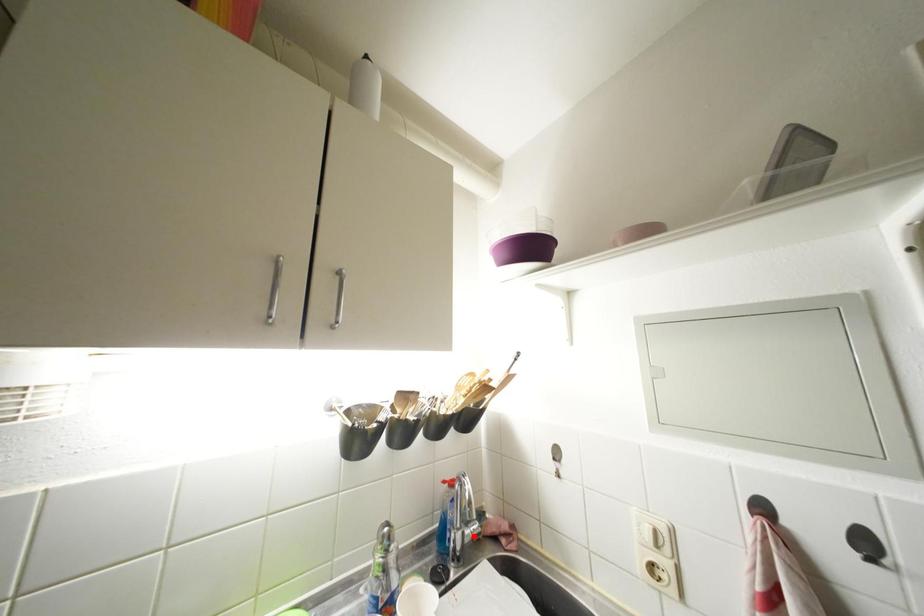
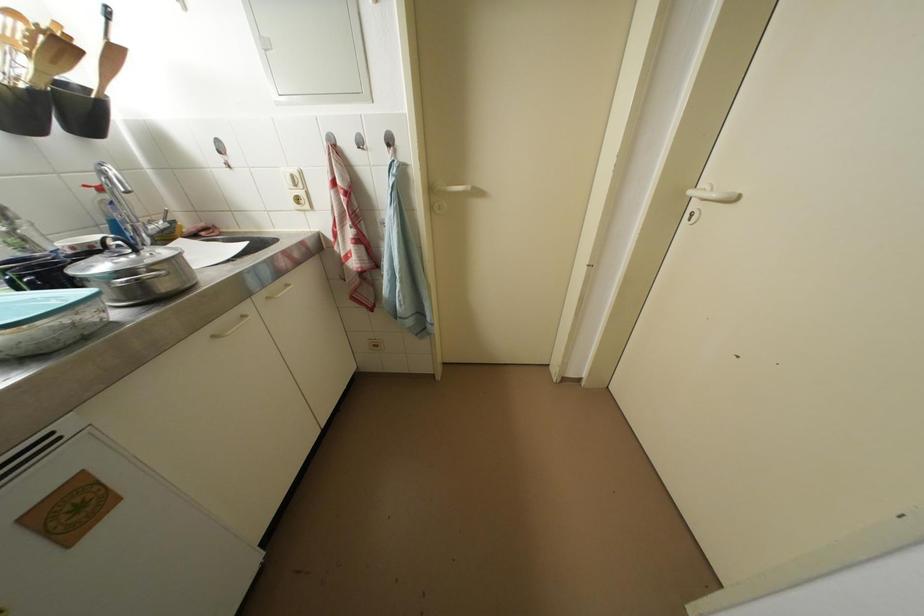
Question: A red point is marked in image1. In image2, is the corresponding 3D point closer to the camera or farther? Reply with the corresponding letter.

Choices:
 (A) The corresponding 3D point is closer.
 (B) The corresponding 3D point is farther.

Answer: (A)